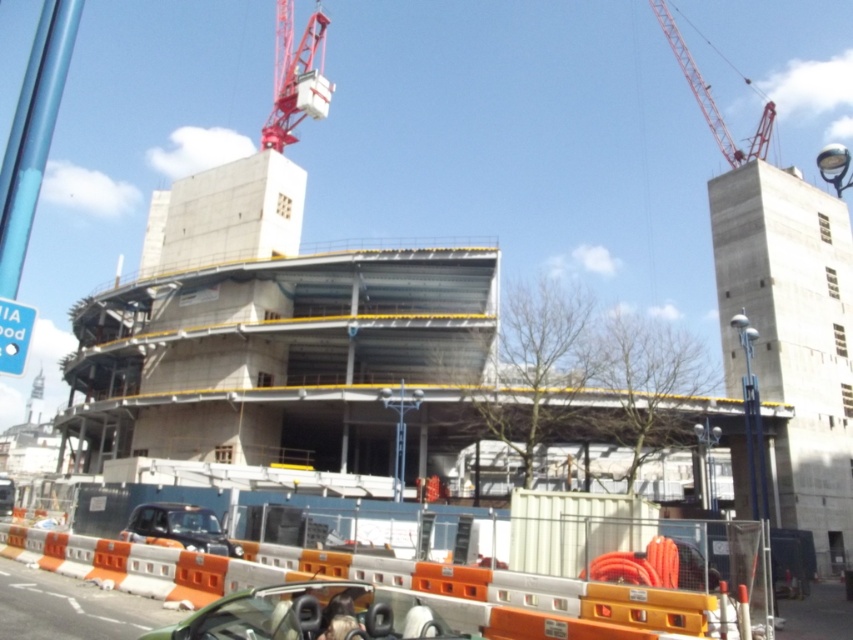
You are a delivery driver approaching the construction site. Your truck is 15 feet wide. There is a path between the metallic red crane at upper center and the matte black car at lower center. Can your truck pass through this path?

The metallic red crane at upper center is 300.89 feet away from the matte black car at lower center. Since the truck is only 15 feet wide, the distance between them is more than enough for the truck to pass through the path.